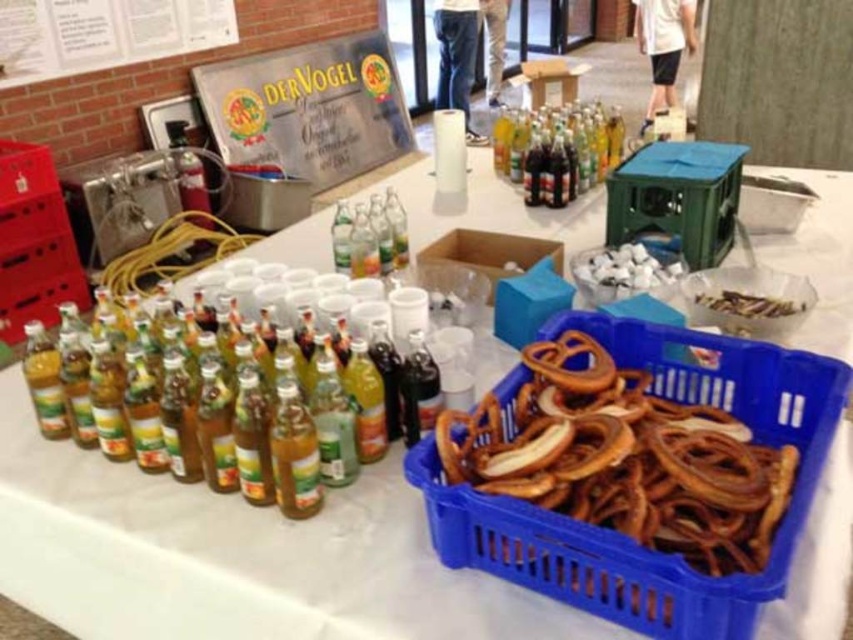
Question: Considering the real-world distances, which object is closest to the blue plastic basket at lower right?

Choices:
 (A) translucent glass bottles at left
 (B) translucent plastic bottles at center
 (C) white cotton balls at center
 (D) metallic signboard at upper center

Answer: (A)

Question: Can you confirm if blue plastic basket at lower right is thinner than dark glass bottle at center?

Choices:
 (A) yes
 (B) no

Answer: (B)

Question: Does translucent glass bottle at center have a larger size compared to white matte pretzel at center?

Choices:
 (A) no
 (B) yes

Answer: (A)

Question: Which of the following is the farthest from the observer?

Choices:
 (A) metallic signboard at upper center
 (B) translucent plastic bottles at center
 (C) translucent glass bottles at left

Answer: (A)

Question: Does translucent plastic bottles at center appear over translucent glass bottle at center?

Choices:
 (A) no
 (B) yes

Answer: (B)

Question: Which point appears farthest from the camera in this image?

Choices:
 (A) (357, 67)
 (B) (291, 424)

Answer: (A)